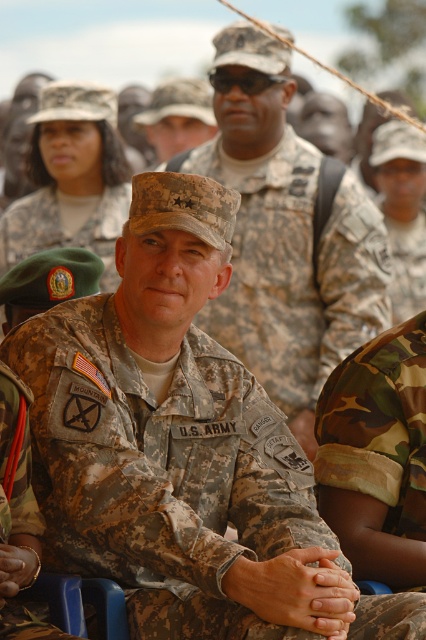
Who is positioned more to the left, camouflage fabric us army uniform at center or green beret at center?

green beret at center

Is point (34, 433) closer to viewer compared to point (28, 250)?

That is True.

Locate an element on the screen. The width and height of the screenshot is (426, 640). camouflage fabric us army uniform at center is located at coordinates (160, 472).

Does green beret at center lie in front of camouflage fabric uniform at center?

Yes, it is.

Does green beret at center appear over camouflage fabric uniform at center?

Yes, green beret at center is above camouflage fabric uniform at center.

Identify the location of green beret at center. The height and width of the screenshot is (640, 426). (63, 228).

Does point (92, 484) lie in front of point (379, 305)?

Yes, point (92, 484) is in front of point (379, 305).

Does camouflage fabric us army uniform at center have a larger size compared to camouflage uniform at center?

No, camouflage fabric us army uniform at center is not bigger than camouflage uniform at center.

What do you see at coordinates (160, 472) in the screenshot? I see `camouflage fabric us army uniform at center` at bounding box center [160, 472].

Identify the location of camouflage fabric us army uniform at center. The image size is (426, 640). (160, 472).